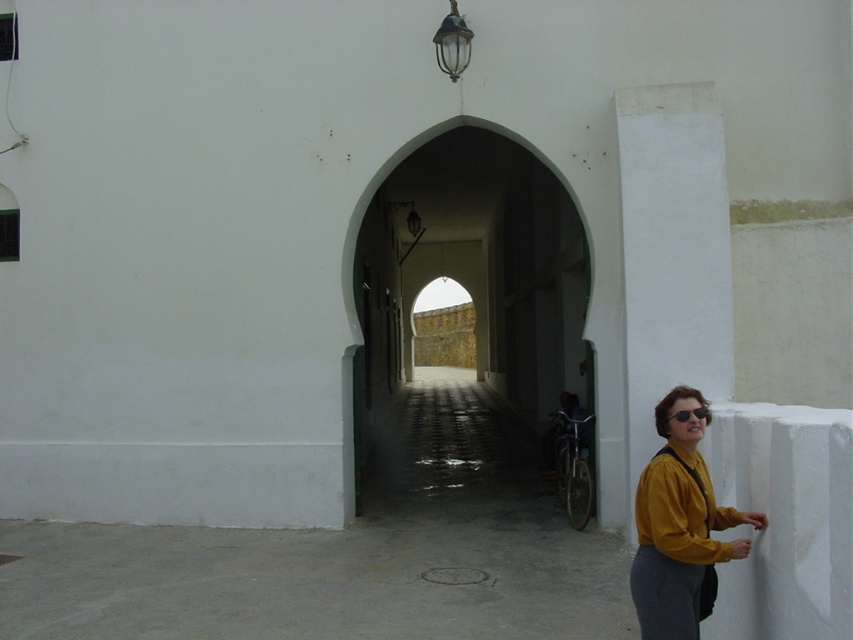
You are a security guard in the area and need to check both the yellow matte shirt at lower right and the matte yellow jacket at lower right. Which one is positioned higher from the ground?

The yellow matte shirt at lower right is above the matte yellow jacket at lower right, so the yellow matte shirt at lower right is positioned higher from the ground.

You are a tailor measuring items for alterations. You have a tailor box that can only hold items wider than 30 cm. You need to decide which of the matte yellow jacket at lower right or the shiny black sunglasses at right can fit into your box. Which item should you choose?

The matte yellow jacket at lower right has a larger width than the shiny black sunglasses at right, so the matte yellow jacket at lower right can fit into the tailor box since it is wider than 30 cm.